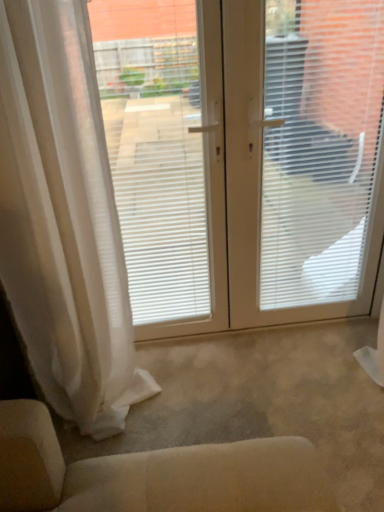
Question: Does white plastic window screen at center, which is counted as the first window screen, starting from the right, have a larger size compared to white sheer curtain at left?

Choices:
 (A) no
 (B) yes

Answer: (A)

Question: Can you confirm if white plastic window screen at center, which is the 2th window screen in left-to-right order, is positioned to the left of white sheer curtain at left?

Choices:
 (A) yes
 (B) no

Answer: (B)

Question: Considering the relative positions of white plastic window screen at center, which is counted as the first window screen, starting from the right, and white sheer curtain at left in the image provided, is white plastic window screen at center, which is counted as the first window screen, starting from the right, to the right of white sheer curtain at left from the viewer's perspective?

Choices:
 (A) no
 (B) yes

Answer: (B)

Question: Is the surface of white plastic window screen at center, which is counted as the first window screen, starting from the right, in direct contact with white sheer curtain at left?

Choices:
 (A) yes
 (B) no

Answer: (B)

Question: From the image's perspective, is white plastic window screen at center, which is the 2th window screen in left-to-right order, beneath white sheer curtain at left?

Choices:
 (A) no
 (B) yes

Answer: (A)

Question: From their relative heights in the image, would you say white plastic window screen at center, which is counted as the first window screen, starting from the right, is taller or shorter than white sheer curtain at left?

Choices:
 (A) tall
 (B) short

Answer: (A)

Question: From the image's perspective, relative to white sheer curtain at left, is white plastic window screen at center, which is counted as the first window screen, starting from the right, above or below?

Choices:
 (A) below
 (B) above

Answer: (B)

Question: From a real-world perspective, is white plastic window screen at center, which is the 2th window screen in left-to-right order, physically located above or below white sheer curtain at left?

Choices:
 (A) above
 (B) below

Answer: (B)

Question: In the image, is white plastic window screen at center, which is counted as the first window screen, starting from the right, positioned in front of or behind white sheer curtain at left?

Choices:
 (A) front
 (B) behind

Answer: (B)

Question: From the image's perspective, relative to white matte window blind at center, is white plastic window screen at center, which is counted as the first window screen, starting from the right, above or below?

Choices:
 (A) below
 (B) above

Answer: (A)

Question: In terms of width, does white plastic window screen at center, which is counted as the first window screen, starting from the right, look wider or thinner when compared to white matte window blind at center?

Choices:
 (A) thin
 (B) wide

Answer: (A)

Question: From their relative heights in the image, would you say white plastic window screen at center, which is counted as the first window screen, starting from the right, is taller or shorter than white matte window blind at center?

Choices:
 (A) tall
 (B) short

Answer: (A)

Question: Does point (271, 225) appear closer or farther from the camera than point (309, 79)?

Choices:
 (A) farther
 (B) closer

Answer: (A)

Question: From a real-world perspective, relative to white sheer curtain at left, is white matte window screen at left, which is the first window screen in left-to-right order, vertically above or below?

Choices:
 (A) above
 (B) below

Answer: (A)

Question: Would you say white matte window screen at left, marked as the 2th window screen in a right-to-left arrangement, is to the left or to the right of white sheer curtain at left in the picture?

Choices:
 (A) left
 (B) right

Answer: (B)